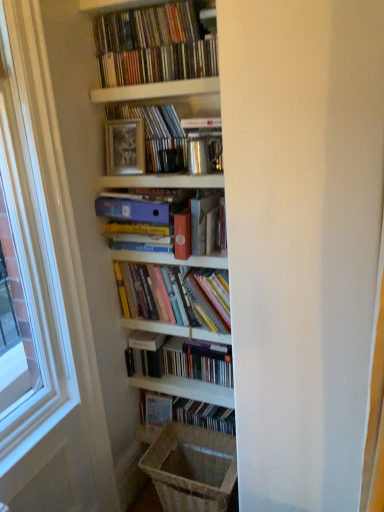
What is the approximate height of white wood window frame at left?

white wood window frame at left is 1.37 meters in height.

What do you see at coordinates (36, 224) in the screenshot? I see `white wood window frame at left` at bounding box center [36, 224].

Find the location of a particular element. white glossy shelf at upper center is located at coordinates (156, 91).

Find the location of a particular element. hardcover books at center, which is counted as the 4th book, starting from the top is located at coordinates (173, 295).

This screenshot has height=512, width=384. What do you see at coordinates (158, 136) in the screenshot?
I see `hardcover book at center, which is the fifth book in bottom-to-top order` at bounding box center [158, 136].

The width and height of the screenshot is (384, 512). Describe the element at coordinates (125, 147) in the screenshot. I see `wooden framed picture at upper center` at that location.

Locate an element on the screen. matte plastic folder at center, which ranks as the 3th book in top-to-bottom order is located at coordinates (143, 216).

Find the location of `white wood window frame at left`. white wood window frame at left is located at coordinates (36, 224).

Which object is closer to the camera taking this photo, wooden framed picture at upper center or matte pink paperback at center?

matte pink paperback at center is more forward.

From a real-world perspective, is wooden framed picture at upper center physically below matte pink paperback at center?

Actually, wooden framed picture at upper center is physically above matte pink paperback at center in the real world.

Does wooden framed picture at upper center appear on the right side of matte pink paperback at center?

No, wooden framed picture at upper center is not to the right of matte pink paperback at center.

Does wooden framed picture at upper center have a greater width compared to matte pink paperback at center?

No.

Considering the relative sizes of hardcover books at center, the 2th book when ordered from bottom to top, and brown woven laundry basket at lower center in the image provided, is hardcover books at center, the 2th book when ordered from bottom to top, wider than brown woven laundry basket at lower center?

In fact, hardcover books at center, the 2th book when ordered from bottom to top, might be narrower than brown woven laundry basket at lower center.

Between hardcover books at center, which is counted as the 5th book, starting from the top, and brown woven laundry basket at lower center, which one has more height?

With more height is hardcover books at center, which is counted as the 5th book, starting from the top.

In the scene shown: Which is more to the left, hardcover books at center, which is counted as the 5th book, starting from the top, or brown woven laundry basket at lower center?

From the viewer's perspective, hardcover books at center, which is counted as the 5th book, starting from the top, appears more on the left side.

Is hardcover books at center, the 2th book when ordered from bottom to top, not within brown woven laundry basket at lower center?

Indeed, hardcover books at center, the 2th book when ordered from bottom to top, is completely outside brown woven laundry basket at lower center.

How different are the orientations of brown woven laundry basket at lower center and hardcover books at center, which is counted as the 5th book, starting from the top, in degrees?

1.01 degrees.

Would you say brown woven laundry basket at lower center is a long distance from hardcover books at center, which is counted as the 5th book, starting from the top?

No, brown woven laundry basket at lower center is not far away from hardcover books at center, which is counted as the 5th book, starting from the top.

Is hardcover books at center, which is counted as the 5th book, starting from the top, surrounded by brown woven laundry basket at lower center?

No, hardcover books at center, which is counted as the 5th book, starting from the top, is not a part of brown woven laundry basket at lower center.

Where is `laundry basket below the hardcover books at center, which is counted as the 5th book, starting from the top (from the image's perspective)`? laundry basket below the hardcover books at center, which is counted as the 5th book, starting from the top (from the image's perspective) is located at coordinates (192, 468).

From a real-world perspective, relative to hardcover books at center, which is counted as the 5th book, starting from the top, is wooden framed picture at upper center vertically above or below?

wooden framed picture at upper center is situated higher than hardcover books at center, which is counted as the 5th book, starting from the top, in the real world.

Would you say wooden framed picture at upper center is a long distance from hardcover books at center, which is counted as the 5th book, starting from the top?

No, there isn't a large distance between wooden framed picture at upper center and hardcover books at center, which is counted as the 5th book, starting from the top.

Is wooden framed picture at upper center inside or outside of hardcover books at center, which is counted as the 5th book, starting from the top?

wooden framed picture at upper center is not enclosed by hardcover books at center, which is counted as the 5th book, starting from the top.

From a real-world perspective, relative to brown woven laundry basket at lower center, is matte pink paperback at center vertically above or below?

matte pink paperback at center is situated higher than brown woven laundry basket at lower center in the real world.

Is brown woven laundry basket at lower center a part of matte pink paperback at center?

No, brown woven laundry basket at lower center is not inside matte pink paperback at center.

Does matte pink paperback at center have a lesser width compared to brown woven laundry basket at lower center?

Yes, matte pink paperback at center is thinner than brown woven laundry basket at lower center.

Consider the image. From the image's perspective, relative to brown woven laundry basket at lower center, is matte pink paperback at center above or below?

From the image's perspective, matte pink paperback at center appears above brown woven laundry basket at lower center.

From a real-world perspective, which is physically above, hardcover books at center, which is counted as the 4th book, starting from the top, or matte black books at center, which is counted as the 1th book, starting from the bottom?

hardcover books at center, which is counted as the 4th book, starting from the top, is physically above.

From their relative heights in the image, would you say hardcover books at center, which is counted as the 4th book, starting from the top, is taller or shorter than matte black books at center, the 6th book positioned from the top?

In the image, hardcover books at center, which is counted as the 4th book, starting from the top, appears to be taller than matte black books at center, the 6th book positioned from the top.

From the picture: Is hardcover books at center, which is counted as the 4th book, starting from the top, thinner than matte black books at center, which is counted as the 1th book, starting from the bottom?

Incorrect, the width of hardcover books at center, which is counted as the 4th book, starting from the top, is not less than that of matte black books at center, which is counted as the 1th book, starting from the bottom.

Does hardcover books at center, which ranks as the third book in bottom-to-top order, turn towards matte black books at center, the 6th book positioned from the top?

No, hardcover books at center, which ranks as the third book in bottom-to-top order, is not oriented towards matte black books at center, the 6th book positioned from the top.

From their relative heights in the image, would you say brown woven laundry basket at lower center is taller or shorter than matte pink paperback at center?

Clearly, brown woven laundry basket at lower center is shorter compared to matte pink paperback at center.

Between brown woven laundry basket at lower center and matte pink paperback at center, which one is positioned behind?

brown woven laundry basket at lower center is further from the camera.

From the image's perspective, does brown woven laundry basket at lower center appear lower than matte pink paperback at center?

Indeed, from the image's perspective, brown woven laundry basket at lower center is shown beneath matte pink paperback at center.

At what (x,y) coordinates should I click in order to perform the action: click on picture frame positioned vertically above the matte pink paperback at center (from a real-world perspective). Please return your answer as a coordinate pair (x, y). This screenshot has height=512, width=384. Looking at the image, I should click on (125, 147).

I want to click on book that is the 2nd object located above the brown woven laundry basket at lower center (from the image's perspective), so click(184, 361).

From the image, which object appears to be nearer to white glossy shelf at upper center, wooden framed picture at upper center or brown woven laundry basket at lower center?

wooden framed picture at upper center is closer to white glossy shelf at upper center.

Based on their spatial positions, is white wood window frame at left or matte pink paperback at center closer to matte plastic cds at upper center, acting as the first book starting from the top?

Among the two, white wood window frame at left is located nearer to matte plastic cds at upper center, acting as the first book starting from the top.

When comparing their distances from brown woven laundry basket at lower center, does white glossy shelf at upper center or matte black books at center, which is counted as the 1th book, starting from the bottom, seem further?

white glossy shelf at upper center is positioned further to the anchor brown woven laundry basket at lower center.

From the image, which object appears to be farther from white wood window frame at left, matte black books at center, the 6th book positioned from the top, or hardcover books at center, which ranks as the third book in bottom-to-top order?

matte black books at center, the 6th book positioned from the top, is further to white wood window frame at left.

Based on their spatial positions, is white wood window frame at left or wooden framed picture at upper center further from matte pink paperback at center?

white wood window frame at left.

Looking at the image, which one is located closer to hardcover books at center, which ranks as the third book in bottom-to-top order, brown woven laundry basket at lower center or white glossy shelf at upper center?

Based on the image, brown woven laundry basket at lower center appears to be nearer to hardcover books at center, which ranks as the third book in bottom-to-top order.

Considering their positions, is hardcover books at center, which is counted as the 4th book, starting from the top, positioned closer to matte pink paperback at center than hardcover books at center, the 2th book when ordered from bottom to top?

hardcover books at center, which is counted as the 4th book, starting from the top, is closer to matte pink paperback at center.

When comparing their distances from white wood window frame at left, does hardcover book at center, the 2th book when ordered from top to bottom, or wooden framed picture at upper center seem further?

hardcover book at center, the 2th book when ordered from top to bottom, is further to white wood window frame at left.

The height and width of the screenshot is (512, 384). What are the coordinates of `shelf between matte plastic cds at upper center, acting as the first book starting from the top, and matte pink paperback at center in the up-down direction` in the screenshot? It's located at (156, 91).

Where is `paperback book between matte plastic cds at upper center, the 6th book positioned from the bottom, and matte black books at center, the 6th book positioned from the top, vertically`? Image resolution: width=384 pixels, height=512 pixels. paperback book between matte plastic cds at upper center, the 6th book positioned from the bottom, and matte black books at center, the 6th book positioned from the top, vertically is located at coordinates (201, 221).

I want to click on book that lies between hardcover books at center, which is counted as the 4th book, starting from the top, and matte black books at center, the 6th book positioned from the top, from top to bottom, so click(x=184, y=361).

Locate an element on the screen. The image size is (384, 512). paperback book between white glossy shelf at upper center and hardcover books at center, which ranks as the third book in bottom-to-top order, from top to bottom is located at coordinates (201, 221).